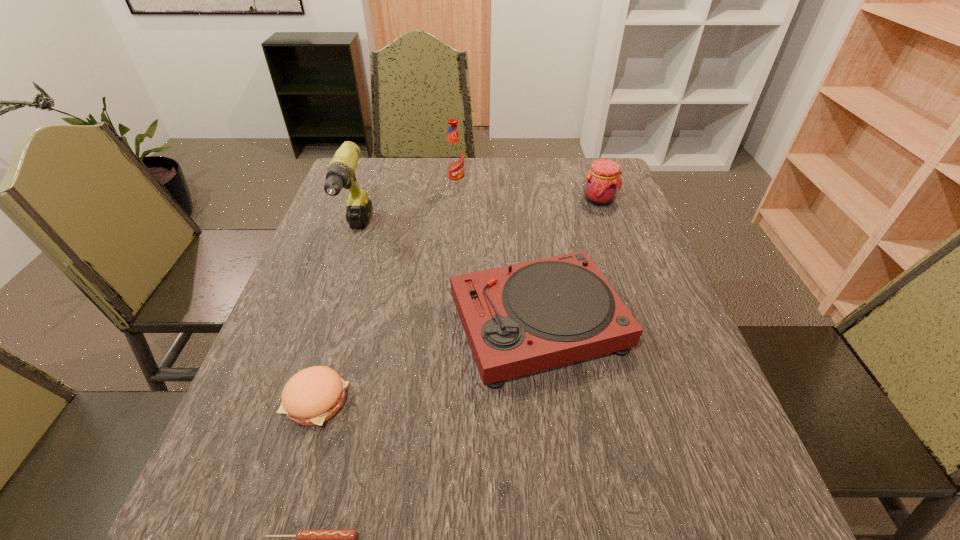
Find the location of a particular element. Image resolution: width=960 pixels, height=540 pixels. root beer at the far edge is located at coordinates (454, 155).

At what (x,y) coordinates should I click in order to perform the action: click on jam at the far edge. Please return your answer as a coordinate pair (x, y). The height and width of the screenshot is (540, 960). Looking at the image, I should click on (602, 181).

The height and width of the screenshot is (540, 960). In order to click on drill located at the left edge in this screenshot , I will do `click(341, 171)`.

Find the location of `patty that is at the left edge`. patty that is at the left edge is located at coordinates (312, 396).

Image resolution: width=960 pixels, height=540 pixels. I want to click on jam that is positioned at the right edge, so click(x=602, y=181).

I want to click on record player located at the right edge, so click(523, 318).

Locate an element on the screen. Image resolution: width=960 pixels, height=540 pixels. object positioned at the far right corner is located at coordinates (602, 181).

In the image, there is a desktop. Identify the location of vacant space at the far edge. Image resolution: width=960 pixels, height=540 pixels. click(x=442, y=177).

In the image, there is a desktop. Find the location of `free space at the near edge`. free space at the near edge is located at coordinates (638, 494).

Locate an element on the screen. free space at the left edge of the desktop is located at coordinates (362, 244).